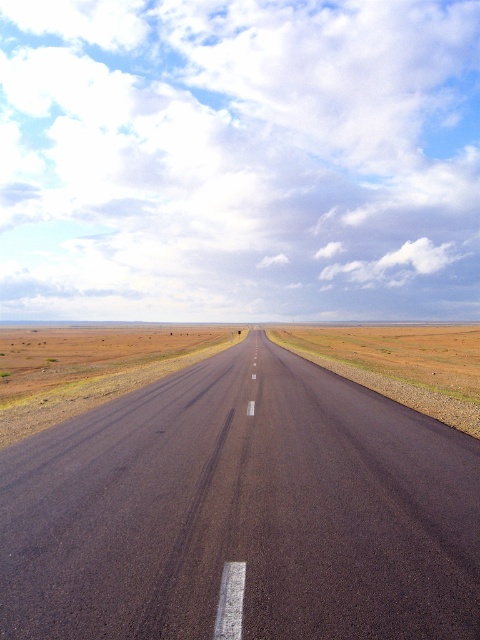
Question: Which object appears closest to the camera in this image?

Choices:
 (A) brown dirt at center
 (B) black asphalt highway at center

Answer: (B)

Question: Does black asphalt highway at center have a smaller size compared to brown dirt at center?

Choices:
 (A) yes
 (B) no

Answer: (A)

Question: Which point is farther from the camera taking this photo?

Choices:
 (A) (7, 321)
 (B) (260, 333)

Answer: (A)

Question: Does black asphalt highway at center have a lesser width compared to brown dirt at center?

Choices:
 (A) no
 (B) yes

Answer: (B)

Question: Is black asphalt highway at center smaller than brown dirt at center?

Choices:
 (A) yes
 (B) no

Answer: (A)